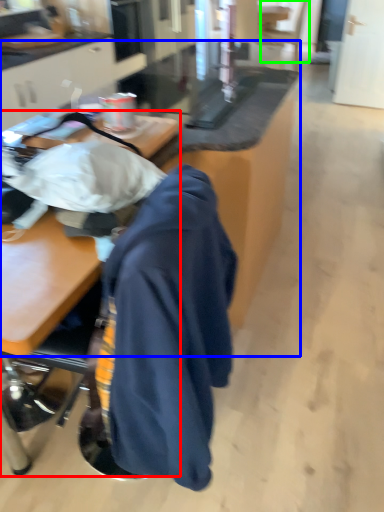
Question: Estimate the real-world distances between objects in this image. Which object is closer to desk (highlighted by a red box), table (highlighted by a blue box) or swivel chair (highlighted by a green box)?

Choices:
 (A) table
 (B) swivel chair

Answer: (A)